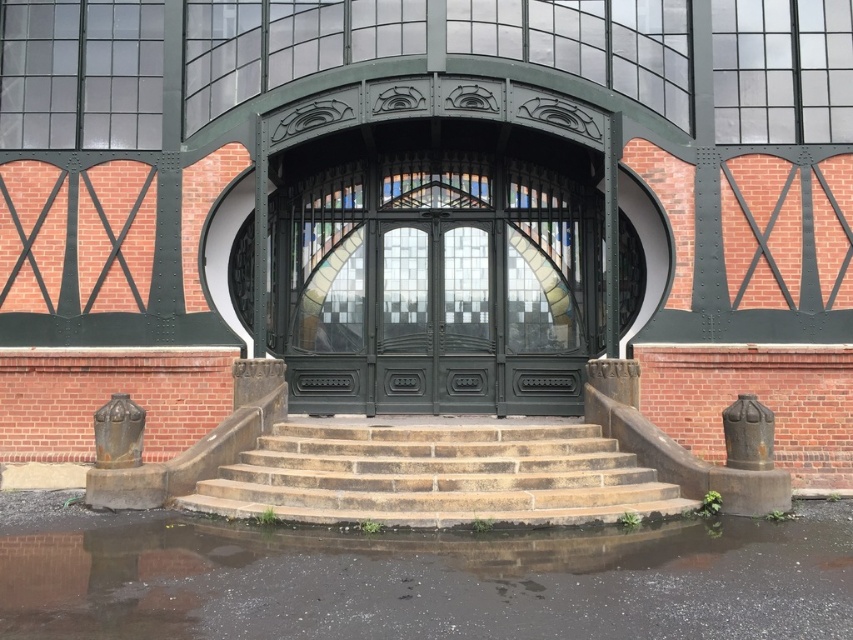
You are standing at the entrance of the building and looking at the two points marked on the facade. Which point, point (x=396, y=394) or point (x=525, y=506), is closer to your eyes?

Point (x=396, y=394) is further to the camera than point (x=525, y=506), so the point closer to your eyes is point (x=525, y=506).